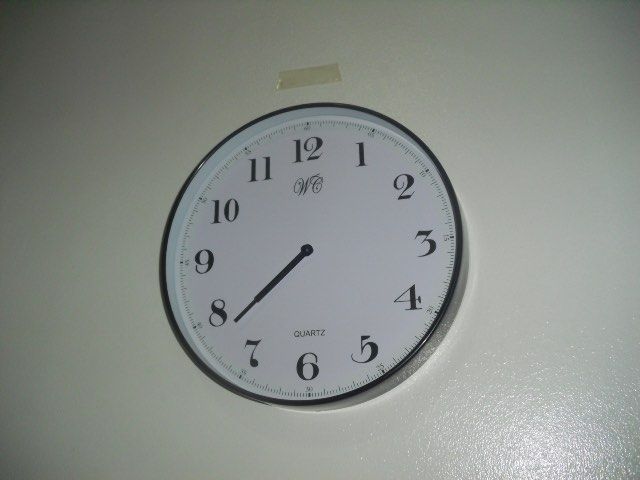
Locate an element on the screen. The width and height of the screenshot is (640, 480). clock is located at coordinates (344, 218).